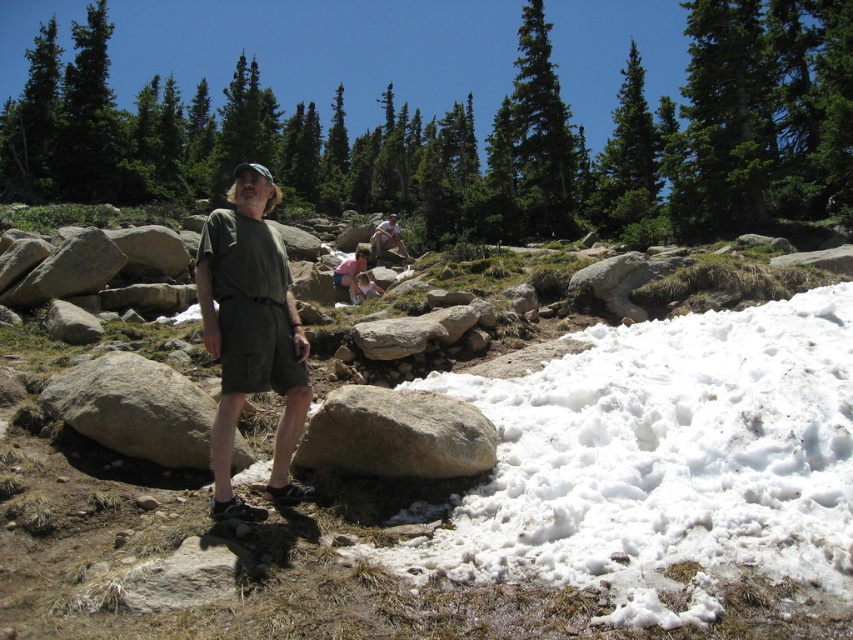
Question: Which point is closer to the camera?

Choices:
 (A) (268, 198)
 (B) (344, 268)

Answer: (A)

Question: Is green matte shorts at center smaller than gray rough boulder at center?

Choices:
 (A) yes
 (B) no

Answer: (B)

Question: Which point is farther to the camera?

Choices:
 (A) white fluffy snow at lower right
 (B) gray rough boulder at center
 (C) gray rock at center

Answer: (C)

Question: From the image, what is the correct spatial relationship of brown rock at center in relation to gray rock at center?

Choices:
 (A) below
 (B) above

Answer: (B)

Question: Can you confirm if white fluffy snow at lower right is positioned to the right of green matte shorts at center?

Choices:
 (A) no
 (B) yes

Answer: (B)

Question: Which point is farther to the camera?

Choices:
 (A) (27, 618)
 (B) (691, 516)
 (C) (166, 378)
 (D) (357, 260)

Answer: (D)